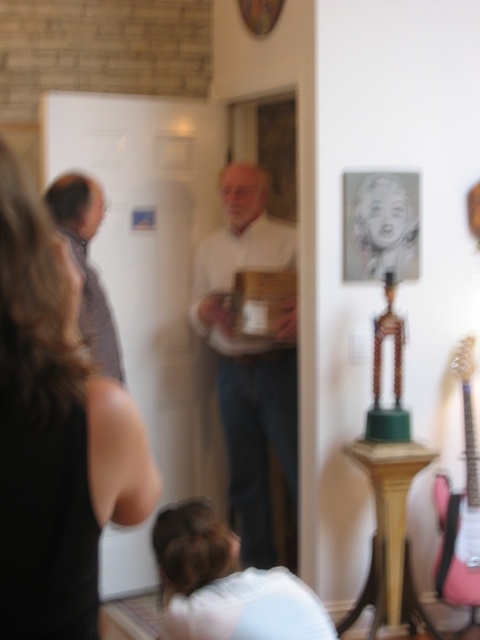
Looking at this image, is the position of white soft fabric at lower center more distant than that of pink glossy guitar at right?

No, it is not.

Does white soft fabric at lower center appear on the left side of pink glossy guitar at right?

Correct, you'll find white soft fabric at lower center to the left of pink glossy guitar at right.

Between point (197, 499) and point (476, 577), which one is positioned behind?

The point (197, 499) is behind.

Identify the location of white soft fabric at lower center. The image size is (480, 640). (226, 584).

Does wooden pedestal at center have a smaller size compared to matte gray shirt at left?

Correct, wooden pedestal at center occupies less space than matte gray shirt at left.

Describe the element at coordinates (389, 534) in the screenshot. I see `wooden pedestal at center` at that location.

The height and width of the screenshot is (640, 480). What are the coordinates of `wooden pedestal at center` in the screenshot? It's located at (389, 534).

Is white matte shirt at center wider than matte gray shirt at left?

Indeed, white matte shirt at center has a greater width compared to matte gray shirt at left.

Is white matte shirt at center to the right of matte gray shirt at left from the viewer's perspective?

Yes, white matte shirt at center is to the right of matte gray shirt at left.

Where is `white matte shirt at center`? white matte shirt at center is located at coordinates (250, 356).